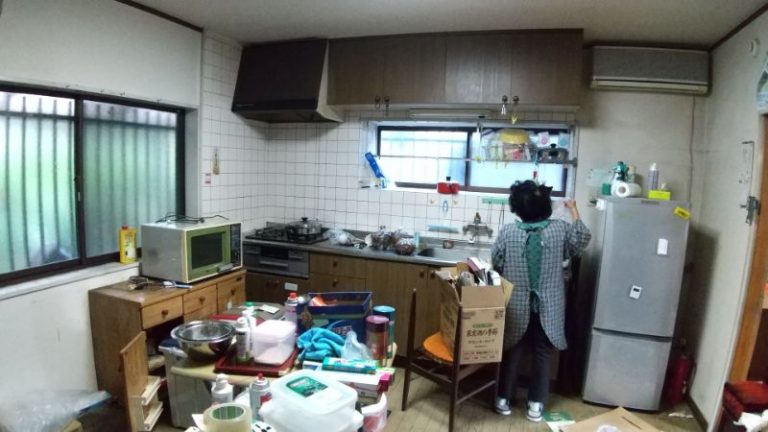
Locate an element on the screen. tiled wall is located at coordinates (245, 146).